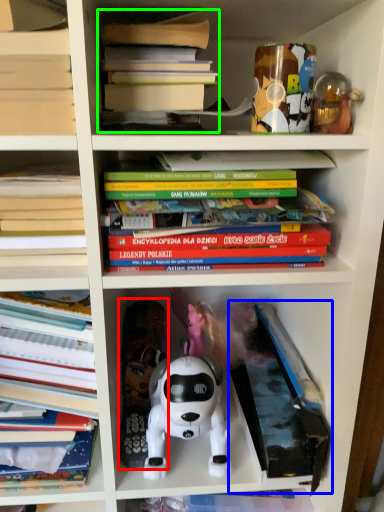
Question: Which object is the farthest from toy (highlighted by a red box)? Choose among these: paperback book (highlighted by a blue box) or book (highlighted by a green box).

Choices:
 (A) paperback book
 (B) book

Answer: (B)